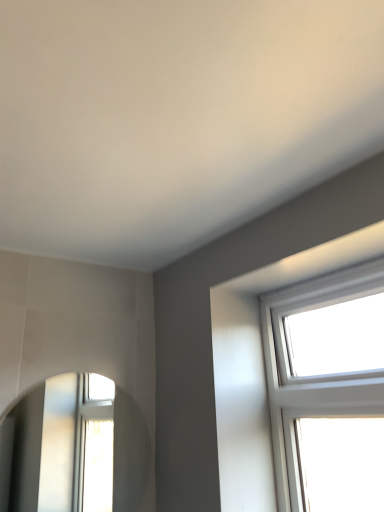
The width and height of the screenshot is (384, 512). What do you see at coordinates (57, 448) in the screenshot? I see `clear glass window at lower left` at bounding box center [57, 448].

You are a GUI agent. You are given a task and a screenshot of the screen. Output one action in this format:
    pyautogui.click(x=<x>, y=<y>)
    Task: Click on the clear glass window at lower left
    Image resolution: width=384 pixels, height=512 pixels.
    Given the screenshot: What is the action you would take?
    pyautogui.click(x=57, y=448)

Identify the location of clear glass window at lower left. (57, 448).